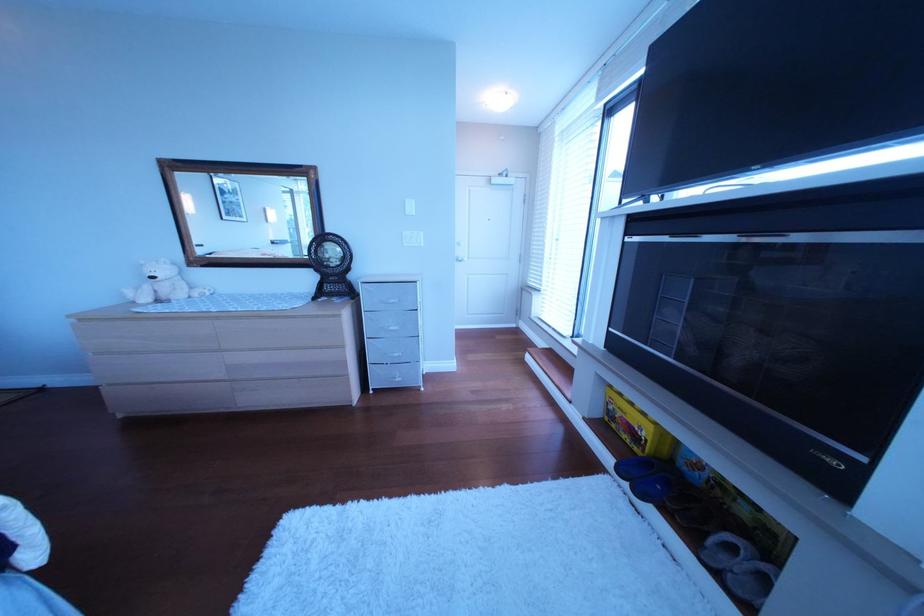
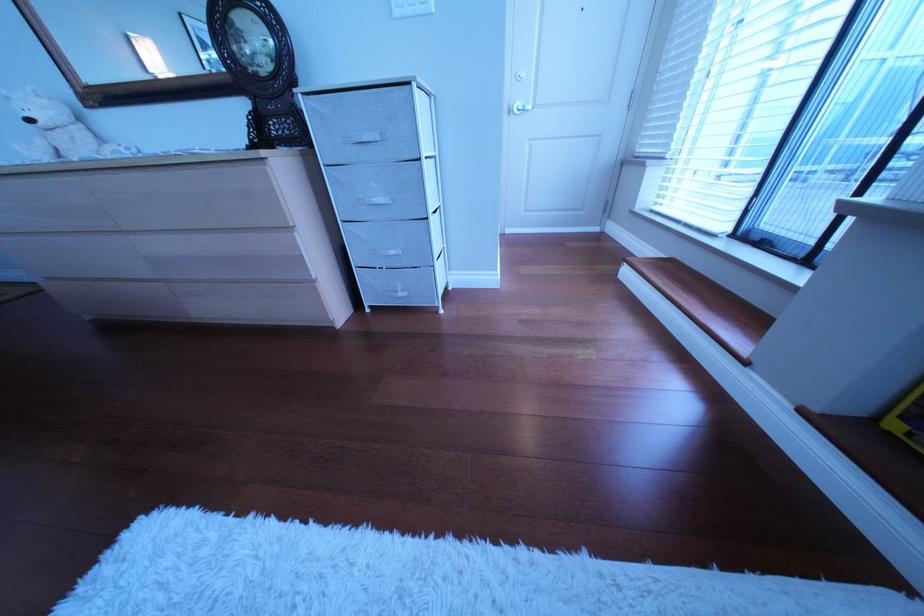
Question: How did the camera likely rotate?

Choices:
 (A) Left
 (B) Right
 (C) Up
 (D) Down

Answer: (D)